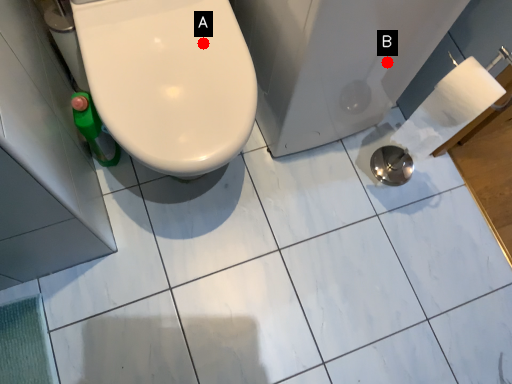
Question: Two points are circled on the image, labeled by A and B beside each circle. Which of the following is the farthest from the observer?

Choices:
 (A) A is further
 (B) B is further

Answer: (B)